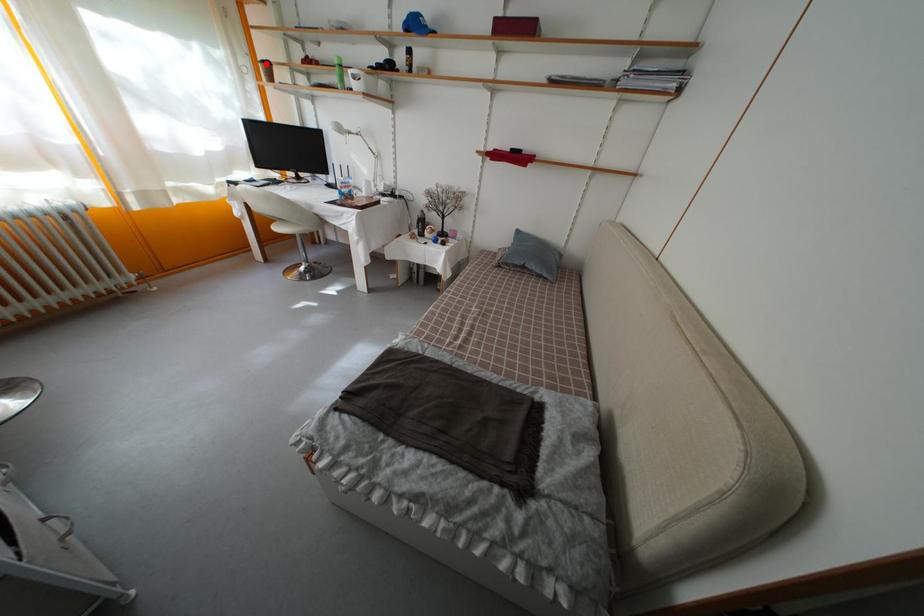
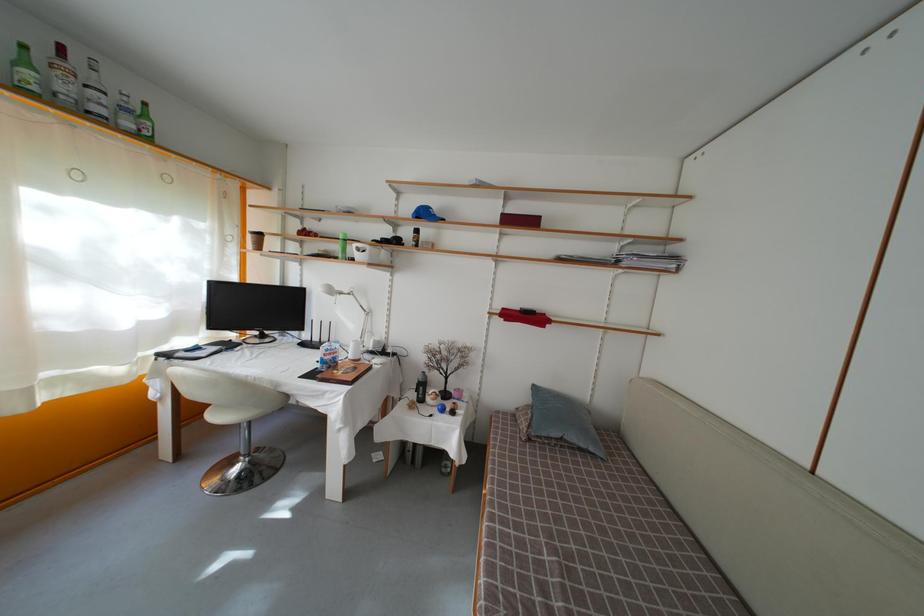
In the second image, find the point that corresponds to the highlighted location in the first image.

(257, 235)